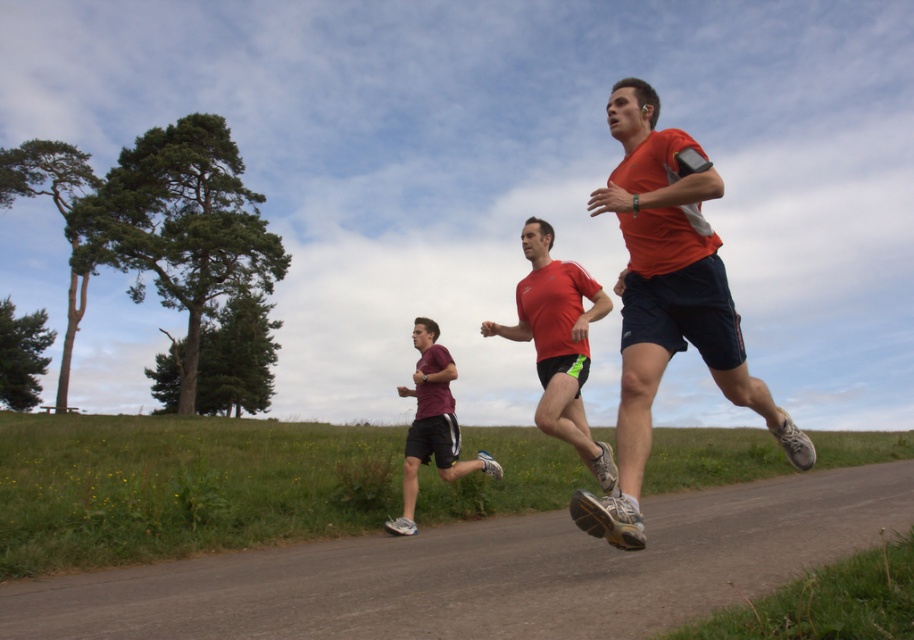
Question: Considering the real-world distances, which object is closest to the matte red shirt at center?

Choices:
 (A) maroon fabric shorts at center
 (B) orange fabric shirt at center

Answer: (B)

Question: Where is orange fabric shirt at center located in relation to matte red shirt at center in the image?

Choices:
 (A) below
 (B) above

Answer: (B)

Question: Which point is closer to the camera?

Choices:
 (A) (603, 474)
 (B) (410, 458)
 (C) (697, 342)

Answer: (C)

Question: Which of the following is the farthest from the observer?

Choices:
 (A) (489, 458)
 (B) (565, 273)

Answer: (A)

Question: Can you confirm if matte red shirt at center is thinner than maroon fabric shorts at center?

Choices:
 (A) yes
 (B) no

Answer: (A)

Question: Does matte red shirt at center appear over maroon fabric shorts at center?

Choices:
 (A) yes
 (B) no

Answer: (A)